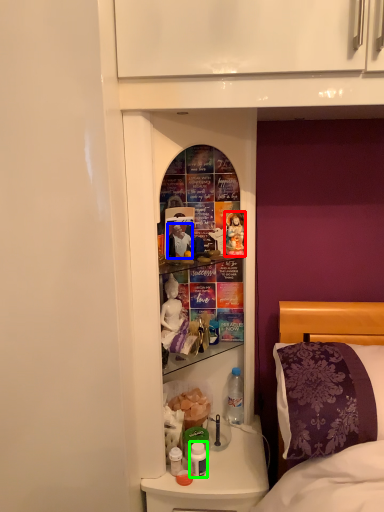
Question: Which object is the farthest from doll (highlighted by a red box)? Choose among these: person (highlighted by a blue box) or bottle (highlighted by a green box).

Choices:
 (A) person
 (B) bottle

Answer: (B)